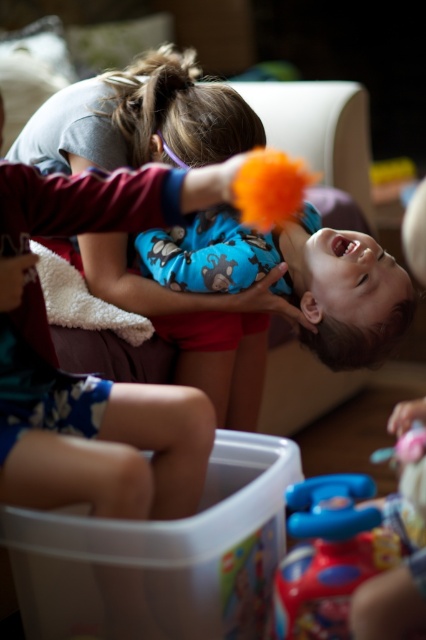
The image size is (426, 640). In order to click on matte gray shirt at upper left in this screenshot , I will do `click(144, 116)`.

Based on the photo, is matte gray shirt at upper left in front of rubberized plastic toy at lower right?

No, it is behind rubberized plastic toy at lower right.

This screenshot has height=640, width=426. I want to click on matte gray shirt at upper left, so click(x=144, y=116).